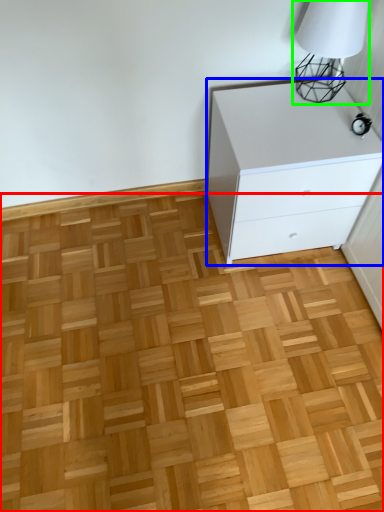
Question: Which object is positioned farthest from hardwood (highlighted by a red box)? Select from chest of drawers (highlighted by a blue box) and table lamp (highlighted by a green box).

Choices:
 (A) chest of drawers
 (B) table lamp

Answer: (B)